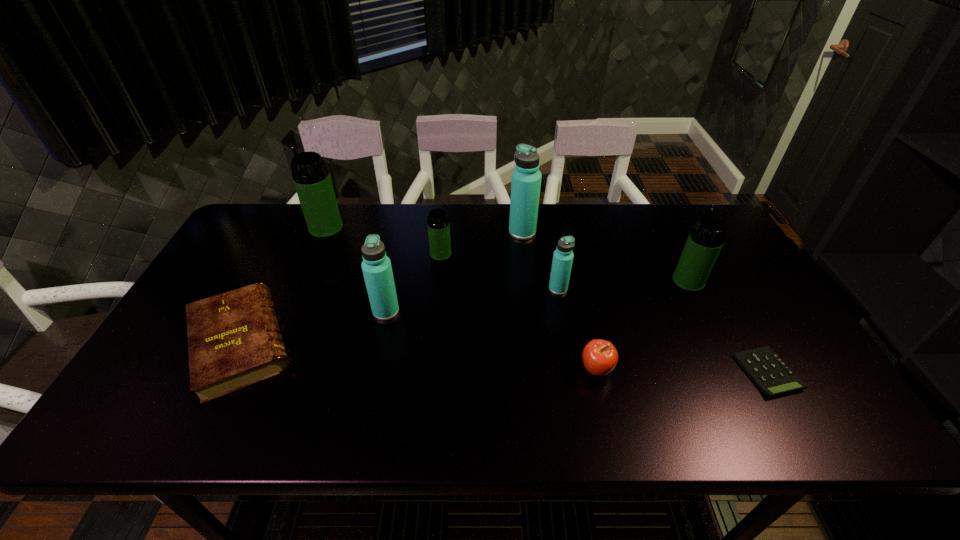
Identify the location of free space that satisfies the following two spatial constraints: 1. on the back side of the nearest aqua thermos bottle; 2. from the spout of the leftmost thermos bottle. (403, 228).